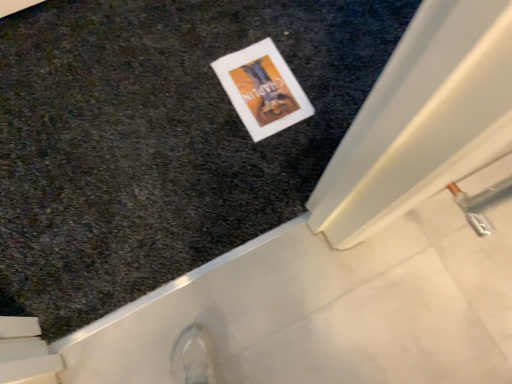
Where is `free space in front of white paper at center`? This screenshot has width=512, height=384. free space in front of white paper at center is located at coordinates (247, 152).